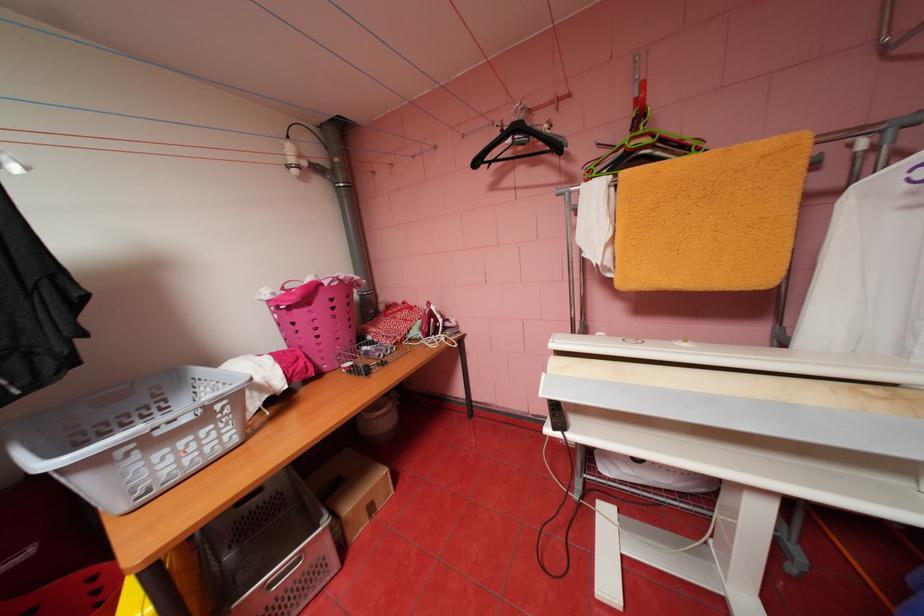
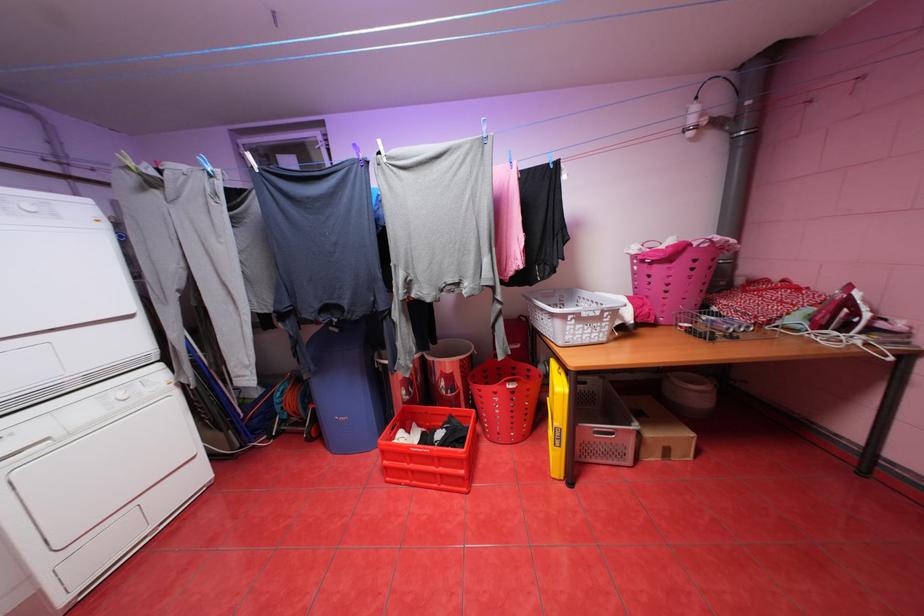
Question: The camera is either moving clockwise (left) or counter-clockwise (right) around the object. The first image is from the beginning of the video and the second image is from the end. Is the camera moving left or right when shooting the video?

Choices:
 (A) Left
 (B) Right

Answer: (B)